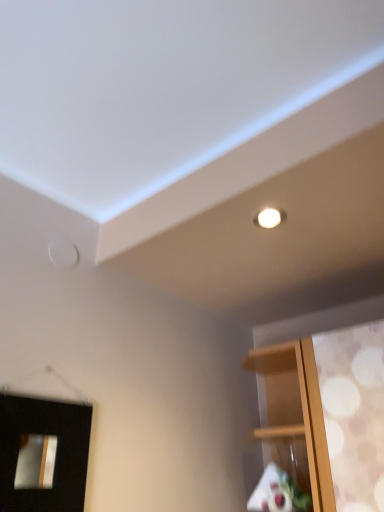
Measure the distance between white glossy cabinet at lower left and camera.

white glossy cabinet at lower left is 80.09 centimeters from camera.

What do you see at coordinates (43, 454) in the screenshot?
I see `white glossy cabinet at lower left` at bounding box center [43, 454].

This screenshot has height=512, width=384. In order to click on white glossy cabinet at lower left in this screenshot , I will do `click(43, 454)`.

Locate an element on the screen. white glossy cabinet at lower left is located at coordinates (43, 454).